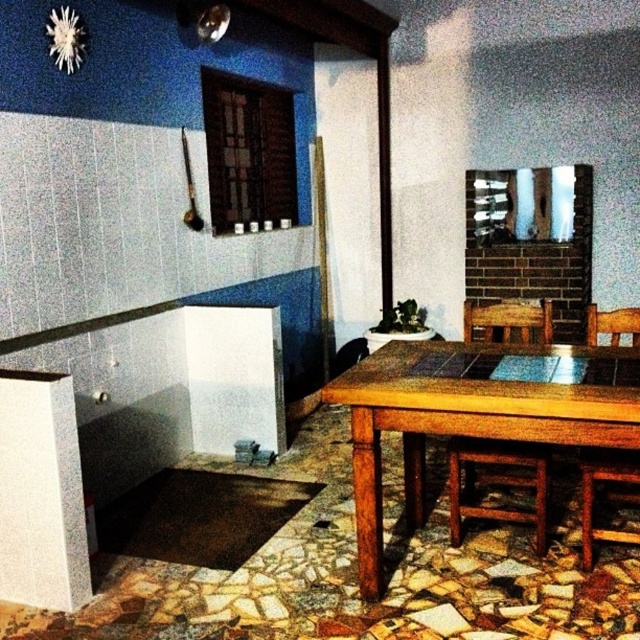
You are planning to place a rectangular tablecloth that is 16 inches long between the wooden chair at center and the wooden chair at lower right. Will the tablecloth be long enough to cover the space between them?

The distance between the wooden chair at center and the wooden chair at lower right is 15.59 inches. Since the tablecloth is 16 inches long, it will be long enough to cover the space between them.

You are sitting at the wooden chair at lower right and want to place your plate on the wooden table at center. Can you reach it without moving from your seat?

The wooden table at center is in front of the wooden chair at lower right, so you can reach it easily without moving from your seat.

You are a guest entering the dining area and need to sit down. The wooden table at center and the wooden chair at lower right are in your view. Which object should you avoid sitting on?

You should avoid sitting on the wooden table at center because it has a greater height compared to the wooden chair at lower right, making it unsuitable for sitting.